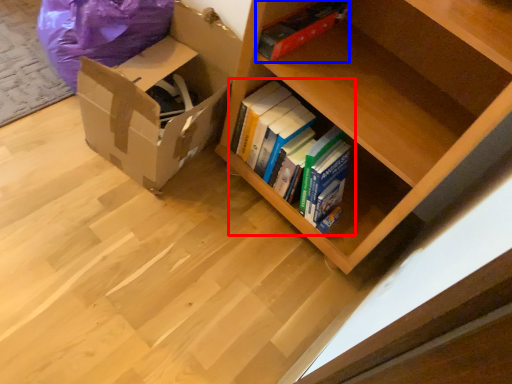
Question: Among these objects, which one is nearest to the camera, book (highlighted by a red box) or paperback book (highlighted by a blue box)?

Choices:
 (A) book
 (B) paperback book

Answer: (B)